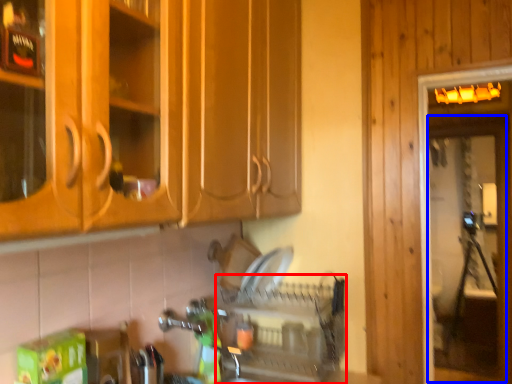
Question: Which of the following is the closest to the observer, dish washer (highlighted by a red box) or screen door (highlighted by a blue box)?

Choices:
 (A) dish washer
 (B) screen door

Answer: (A)